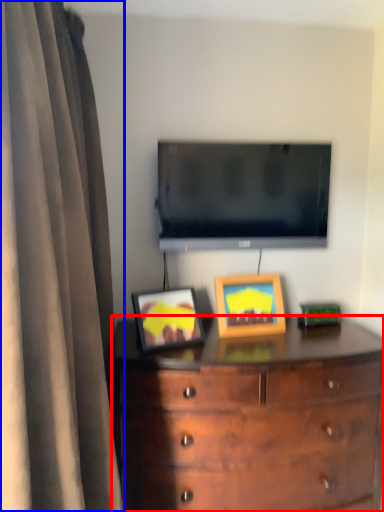
Question: Which point is closer to the camera, chest of drawers (highlighted by a red box) or curtain (highlighted by a blue box)?

Choices:
 (A) chest of drawers
 (B) curtain

Answer: (B)